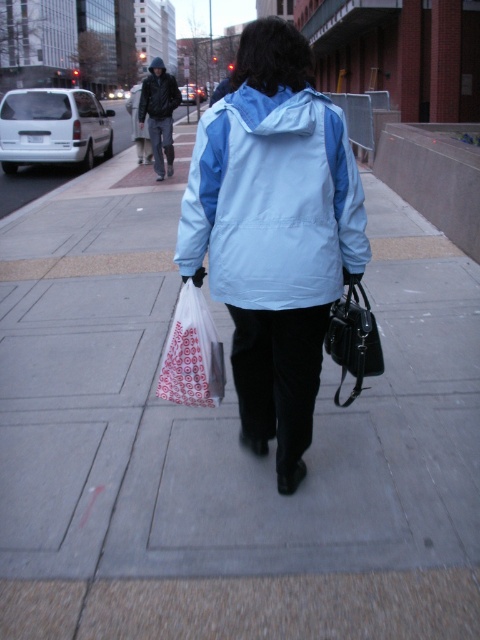
Question: Which of the following is the farthest from the observer?

Choices:
 (A) translucent plastic bag at lower center
 (B) black leather jacket at upper left
 (C) light blue/waterproof jacket at center

Answer: (B)

Question: Does light blue fabric jacket at center appear over light blue/waterproof jacket at center?

Choices:
 (A) yes
 (B) no

Answer: (B)

Question: Can you confirm if light blue fabric jacket at center is thinner than light blue/waterproof jacket at center?

Choices:
 (A) yes
 (B) no

Answer: (B)

Question: Is light blue fabric jacket at center positioned behind black leather jacket at upper left?

Choices:
 (A) yes
 (B) no

Answer: (B)

Question: Which of these objects is positioned closest to the black leather jacket at upper left?

Choices:
 (A) black leather handbag at center
 (B) light blue/waterproof jacket at center
 (C) light blue fabric jacket at center

Answer: (C)

Question: Which object appears farthest from the camera in this image?

Choices:
 (A) light blue fabric jacket at center
 (B) light blue/waterproof jacket at center
 (C) black leather handbag at center
 (D) translucent plastic bag at lower center

Answer: (D)